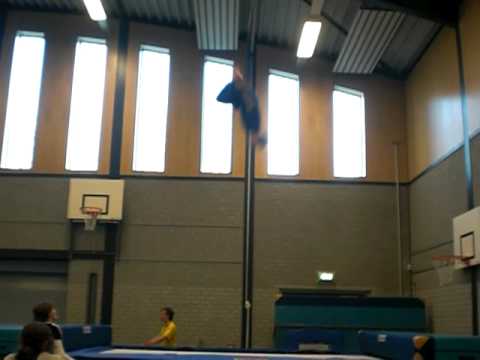
Identify the location of wall. The width and height of the screenshot is (480, 360). (60, 26).